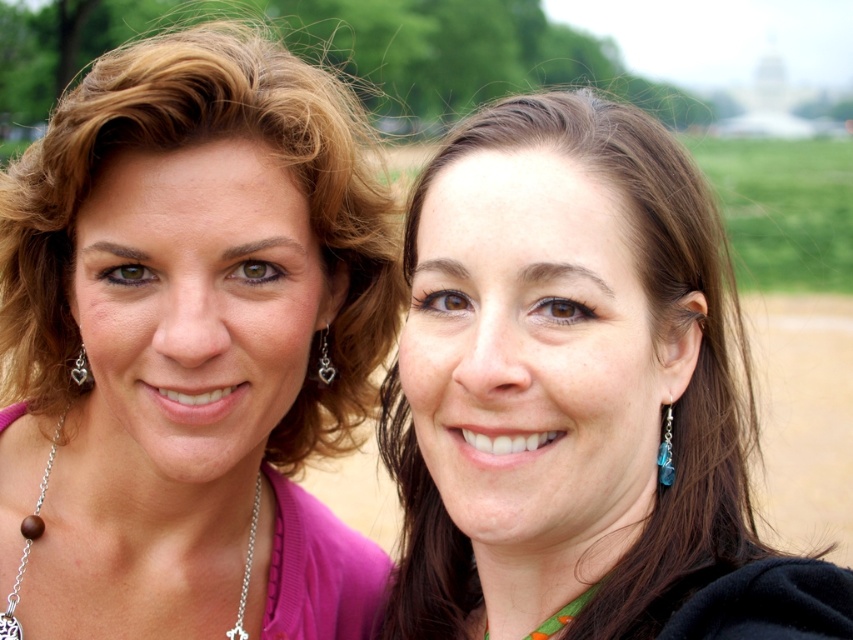
You are standing in front of the two women in the image. You want to place a small flower between the two points labeled point (787,301) and point (329,376). Based on their positions, which point should the flower be closer to in order to be placed between them?

The flower should be placed closer to point (329,376) because point (787,301) is behind it, so the midpoint between them would be closer to the front point.

You are standing in a natural setting with two women posing closely together. You notice a point marked at coordinates (x=804, y=419). Based on the scene description, what is the object located at this point?

The point at coordinates (x=804, y=419) indicates brown sandy dirt at lower right.